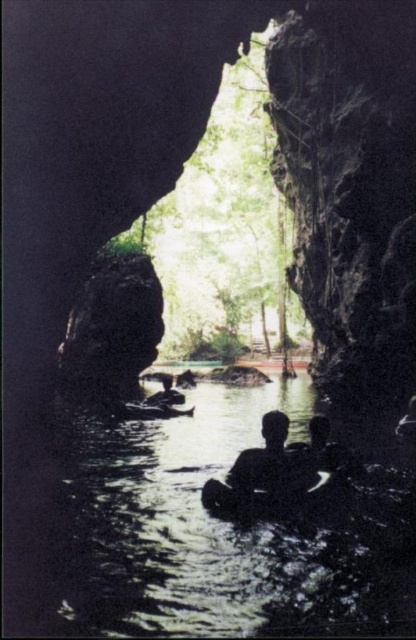
Does wooden canoe at center appear over silhouette human at center?

No, wooden canoe at center is not above silhouette human at center.

Is wooden canoe at center to the left of silhouette human at center from the viewer's perspective?

Indeed, wooden canoe at center is positioned on the left side of silhouette human at center.

Who is more distant from viewer, (153,416) or (411,429)?

The point (153,416) is behind.

Where is `wooden canoe at center`? The width and height of the screenshot is (416, 640). wooden canoe at center is located at coordinates (151, 410).

Is black rubber raft at center bigger than wooden canoe at center?

Indeed, black rubber raft at center has a larger size compared to wooden canoe at center.

Who is more forward, (101, 557) or (141, 419)?

Point (101, 557)

What do you see at coordinates (210, 532) in the screenshot? The width and height of the screenshot is (416, 640). I see `black rubber raft at center` at bounding box center [210, 532].

You are a GUI agent. You are given a task and a screenshot of the screen. Output one action in this format:
    pyautogui.click(x=<x>, y=<y>)
    Task: Click on the black rubber raft at center
    Image resolution: width=416 pixels, height=640 pixels.
    Given the screenshot: What is the action you would take?
    pyautogui.click(x=210, y=532)

Who is positioned more to the right, black rubber raft at center or silhouette human at center?

silhouette human at center

Measure the distance from black rubber raft at center to silhouette human at center.

black rubber raft at center and silhouette human at center are 13.17 feet apart.

Between point (111, 444) and point (403, 422), which one is positioned behind?

Point (403, 422)

Where is `black rubber raft at center`? The image size is (416, 640). black rubber raft at center is located at coordinates (210, 532).